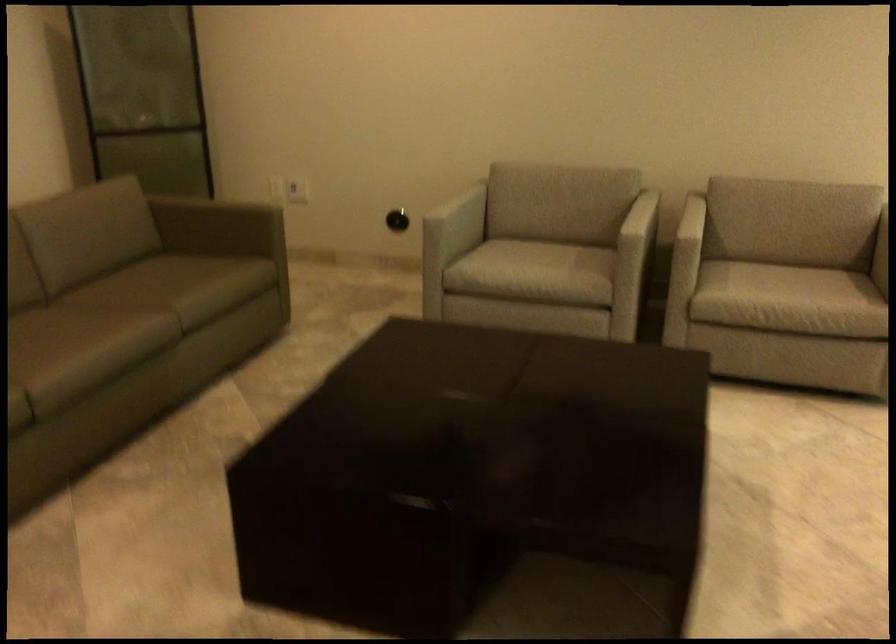
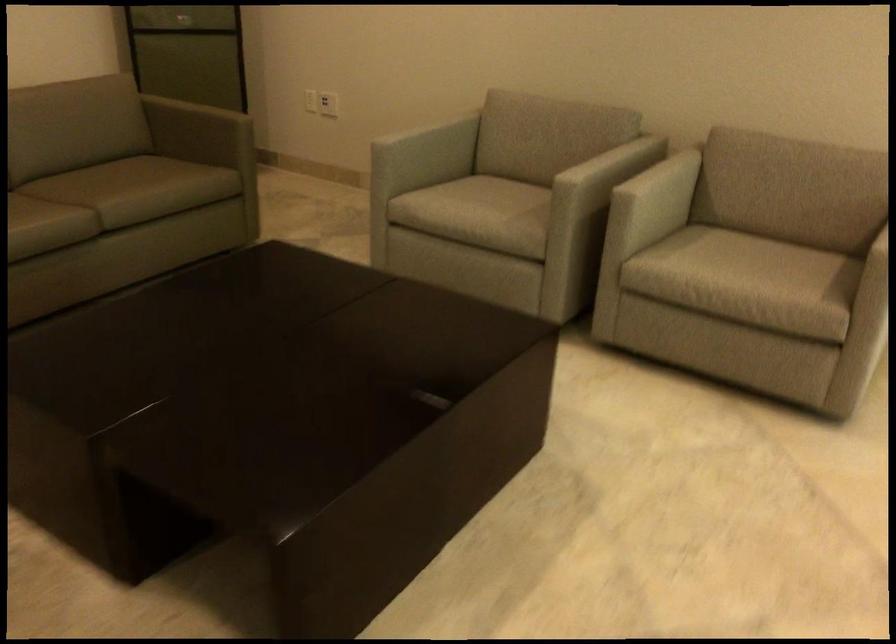
The point at (533, 261) is marked in the first image. Where is the corresponding point in the second image?

(480, 207)